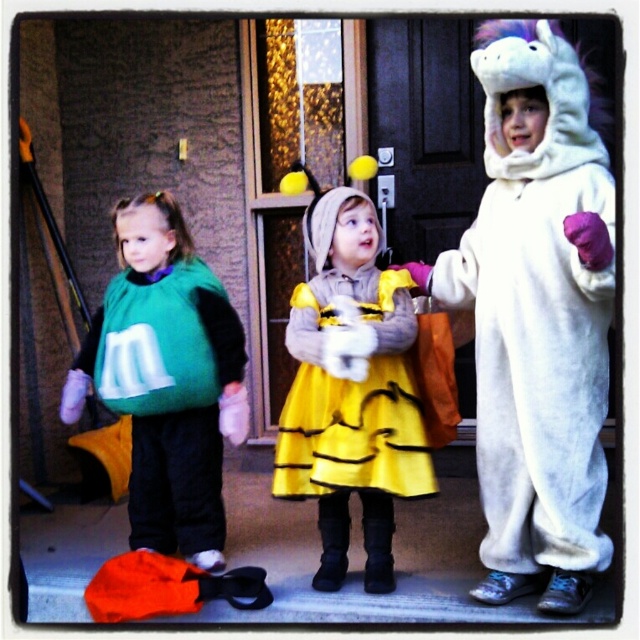
Who is positioned more to the right, white furry unicorn at right or green fabric m&m at left?

Positioned to the right is white furry unicorn at right.

Which of these two, white furry unicorn at right or green fabric m&m at left, stands taller?

white furry unicorn at right is taller.

Where is `white furry unicorn at right`? This screenshot has width=640, height=640. white furry unicorn at right is located at coordinates (538, 314).

You are a GUI agent. You are given a task and a screenshot of the screen. Output one action in this format:
    pyautogui.click(x=<x>, y=<y>)
    Task: Click on the white furry unicorn at right
    This screenshot has height=640, width=640.
    Given the screenshot: What is the action you would take?
    pyautogui.click(x=538, y=314)

Who is shorter, yellow satin dress at center or green fabric m&m at left?

With less height is green fabric m&m at left.

Which is in front, point (342, 308) or point (90, 339)?

Positioned in front is point (342, 308).

Who is more forward, (368, 547) or (132, 472)?

Point (368, 547) is more forward.

I want to click on yellow satin dress at center, so click(x=352, y=390).

Can you confirm if white furry unicorn at right is positioned to the left of yellow satin dress at center?

No, white furry unicorn at right is not to the left of yellow satin dress at center.

Between point (492, 518) and point (301, 284), which one is positioned behind?

Positioned behind is point (301, 284).

This screenshot has height=640, width=640. What are the coordinates of `white furry unicorn at right` in the screenshot? It's located at (538, 314).